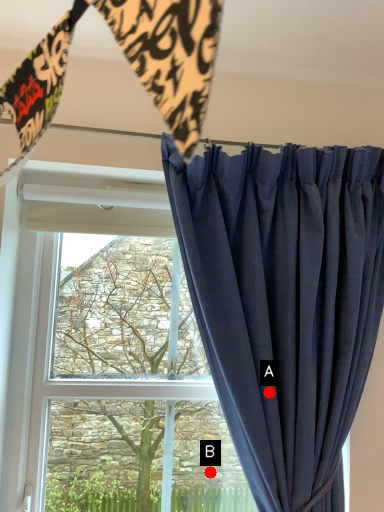
Question: Two points are circled on the image, labeled by A and B beside each circle. Which of the following is the closest to the observer?

Choices:
 (A) A is closer
 (B) B is closer

Answer: (A)